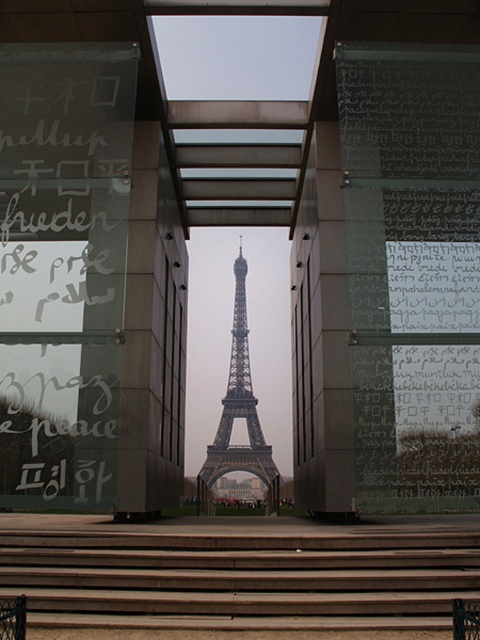
Question: Can you confirm if brown wooden stairs at center is positioned to the left of metallic gray eiffel tower at center?

Choices:
 (A) no
 (B) yes

Answer: (B)

Question: Can you confirm if brown wooden stairs at center is wider than metallic gray eiffel tower at center?

Choices:
 (A) yes
 (B) no

Answer: (A)

Question: Which point is closer to the camera taking this photo?

Choices:
 (A) (276, 477)
 (B) (135, 557)

Answer: (B)

Question: Is brown wooden stairs at center above metallic gray eiffel tower at center?

Choices:
 (A) no
 (B) yes

Answer: (A)